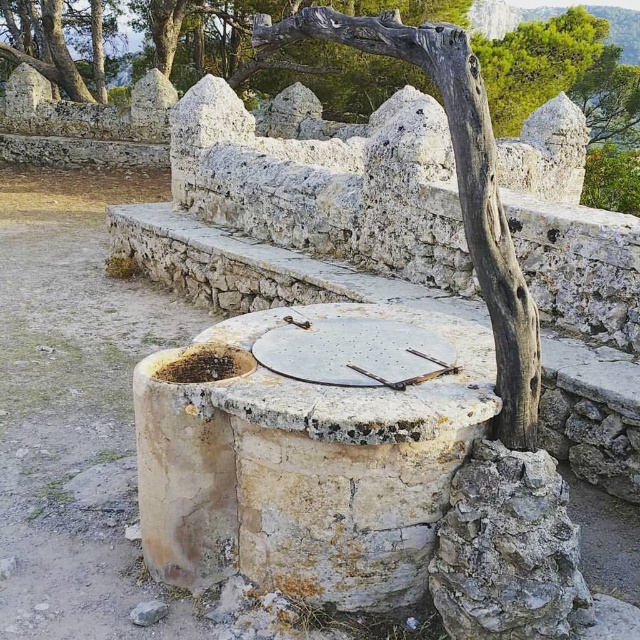
Question: Does smooth gray stone wall at upper center come in front of gray rough tree trunk at center?

Choices:
 (A) no
 (B) yes

Answer: (A)

Question: Can you confirm if smooth gray stone wall at upper center is bigger than gray rough tree trunk at center?

Choices:
 (A) yes
 (B) no

Answer: (A)

Question: Is smooth gray stone wall at upper center bigger than gray rough tree trunk at center?

Choices:
 (A) no
 (B) yes

Answer: (B)

Question: Which point is farther from the camera taking this photo?

Choices:
 (A) (278, 44)
 (B) (595, 116)

Answer: (B)